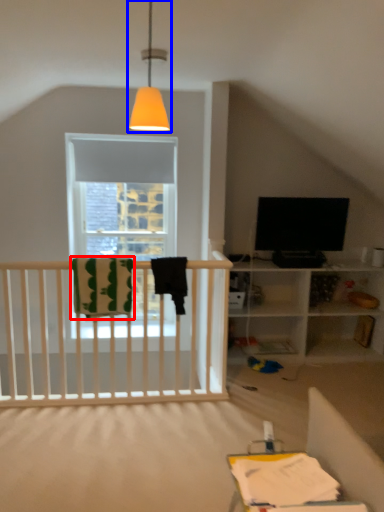
Question: Which point is further to the camera, blanket (highlighted by a red box) or lamp (highlighted by a blue box)?

Choices:
 (A) blanket
 (B) lamp

Answer: (A)